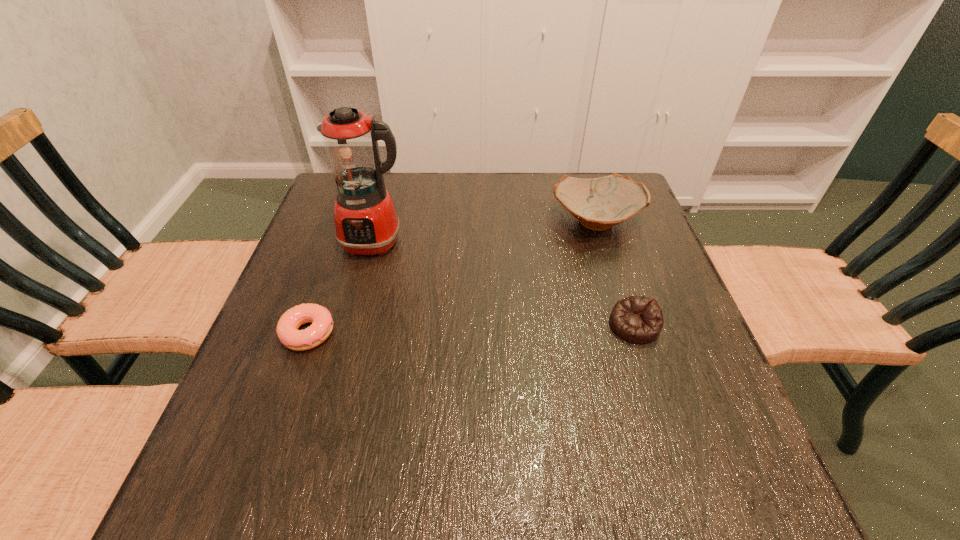
Where is `doughnut that is at the left edge`? doughnut that is at the left edge is located at coordinates (287, 331).

This screenshot has height=540, width=960. Identify the location of pottery located in the right edge section of the desktop. (600, 203).

I want to click on beanbag that is at the right edge, so click(x=638, y=319).

Where is `object present at the far right corner`? The width and height of the screenshot is (960, 540). object present at the far right corner is located at coordinates point(600,203).

At what (x,y) coordinates should I click in order to perform the action: click on free space at the far edge of the desktop. Please return your answer as a coordinate pair (x, y). Image resolution: width=960 pixels, height=540 pixels. Looking at the image, I should click on (510, 217).

Identify the location of free location at the near edge. The height and width of the screenshot is (540, 960). pos(407,482).

At what (x,y) coordinates should I click in order to perform the action: click on free space at the left edge of the desktop. Please return your answer as a coordinate pair (x, y). Image resolution: width=960 pixels, height=540 pixels. Looking at the image, I should click on (337, 244).

Where is `vacant space at the right edge of the desktop`? The height and width of the screenshot is (540, 960). vacant space at the right edge of the desktop is located at coordinates (608, 265).

Locate an element on the screen. free area in between the doughnut and the pottery is located at coordinates (452, 277).

Where is `free space between the doughnut and the beanbag`? free space between the doughnut and the beanbag is located at coordinates (471, 329).